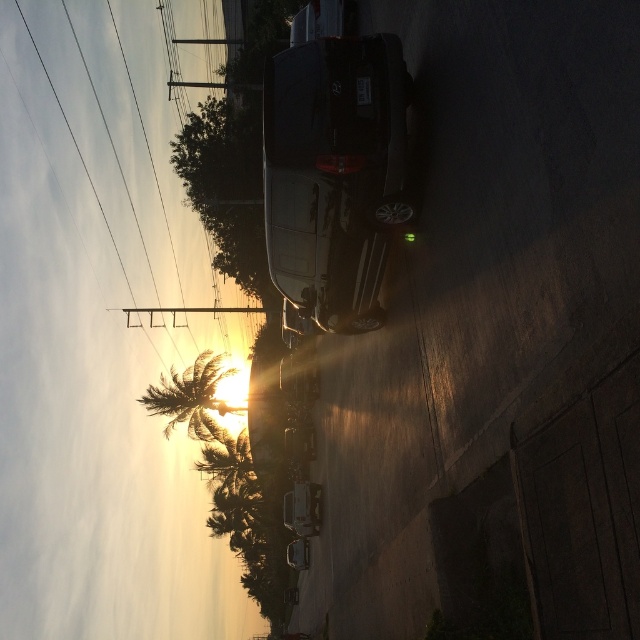
Question: Which point is closer to the camera?

Choices:
 (A) (269, 109)
 (B) (209, 449)
 (C) (166, 435)

Answer: (A)

Question: Is satin black suv at center bigger than green leafy palm tree at lower left?

Choices:
 (A) no
 (B) yes

Answer: (A)

Question: Which point appears farthest from the camera in this image?

Choices:
 (A) (164, 400)
 (B) (326, 301)
 (C) (236, 460)

Answer: (C)

Question: Which of the following is the closest to the observer?

Choices:
 (A) (172, 381)
 (B) (212, 440)
 (C) (344, 192)

Answer: (C)

Question: Does satin black suv at center have a smaller size compared to green leafy palm tree at lower left?

Choices:
 (A) yes
 (B) no

Answer: (A)

Question: In this image, where is satin black suv at center located relative to green leafy palm tree at lower left?

Choices:
 (A) above
 (B) below

Answer: (A)